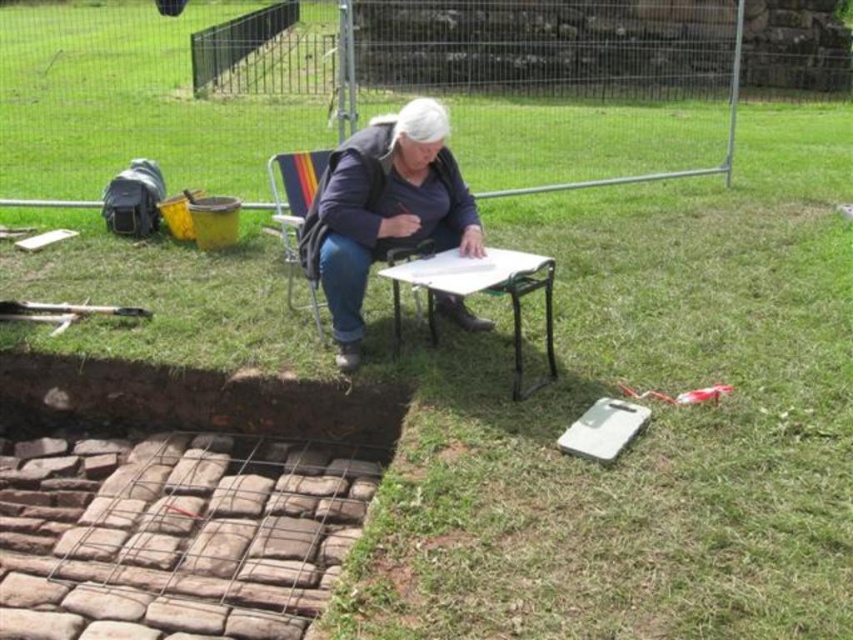
Does blue fabric jacket at center have a greater width compared to metallic folding chair at center?

Correct, the width of blue fabric jacket at center exceeds that of metallic folding chair at center.

Does blue fabric jacket at center appear on the left side of metallic folding chair at center?

Incorrect, blue fabric jacket at center is not on the left side of metallic folding chair at center.

The height and width of the screenshot is (640, 853). I want to click on blue fabric jacket at center, so click(x=384, y=209).

Can you confirm if white plastic table at center is shorter than metallic folding chair at center?

Yes, white plastic table at center is shorter than metallic folding chair at center.

Which is above, white plastic table at center or metallic folding chair at center?

Positioned higher is metallic folding chair at center.

Is point (550, 260) less distant than point (283, 236)?

Yes.

The height and width of the screenshot is (640, 853). Identify the location of white plastic table at center. (480, 291).

Can you confirm if blue fabric jacket at center is shorter than white plastic table at center?

In fact, blue fabric jacket at center may be taller than white plastic table at center.

Does point (405, 212) lie in front of point (525, 285)?

No, (405, 212) is further to viewer.

Does point (355, 188) lie behind point (552, 344)?

No, it is in front of (552, 344).

Locate an element on the screen. The width and height of the screenshot is (853, 640). blue fabric jacket at center is located at coordinates point(384,209).